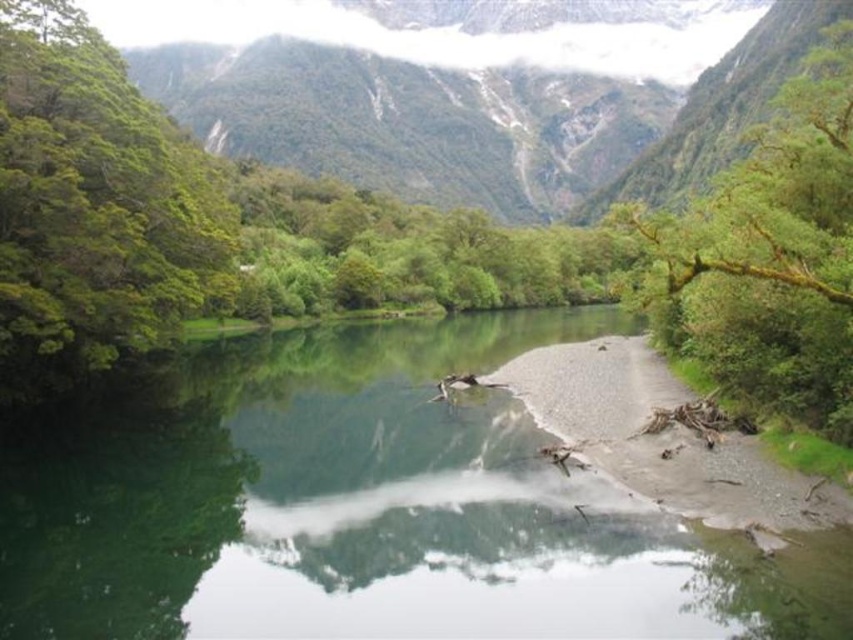
Which is more to the right, clear water at center or green mossy rock at upper center?

green mossy rock at upper center

Between clear water at center and green mossy rock at upper center, which one has more height?

green mossy rock at upper center

Where is `clear water at center`? clear water at center is located at coordinates (363, 506).

Is green leafy tree at left positioned at the back of green mossy branch at upper right?

No, green leafy tree at left is in front of green mossy branch at upper right.

Does green leafy tree at left have a smaller size compared to green mossy branch at upper right?

Yes, green leafy tree at left is smaller than green mossy branch at upper right.

Is point (216, 180) less distant than point (802, 198)?

No, (216, 180) is behind (802, 198).

The height and width of the screenshot is (640, 853). Find the location of `green leafy tree at left`. green leafy tree at left is located at coordinates [x=94, y=209].

Can you confirm if clear water at center is taller than green mossy branch at upper right?

Incorrect, clear water at center's height is not larger of green mossy branch at upper right's.

Does point (486, 598) come closer to viewer compared to point (718, 220)?

Yes, it is.

The image size is (853, 640). In order to click on clear water at center in this screenshot , I will do `click(363, 506)`.